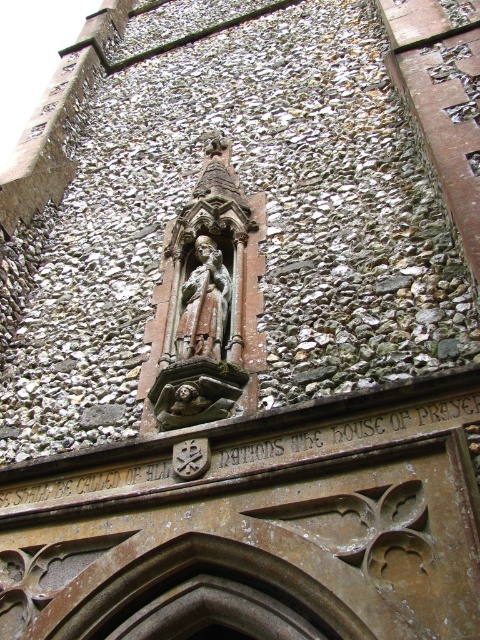
Does carved stone statue at center appear over brown stone gargoyle at center?

Yes, carved stone statue at center is above brown stone gargoyle at center.

How distant is carved stone statue at center from brown stone gargoyle at center?

carved stone statue at center is 6.76 meters from brown stone gargoyle at center.

This screenshot has height=640, width=480. What do you see at coordinates (204, 305) in the screenshot?
I see `carved stone statue at center` at bounding box center [204, 305].

Locate an element on the screen. The width and height of the screenshot is (480, 640). carved stone statue at center is located at coordinates (204, 305).